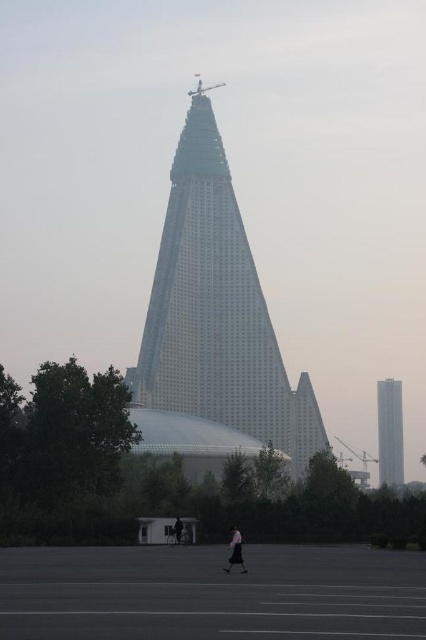
Question: Is light pink fabric skirt at lower center bigger than dark gray fabric jacket at center?

Choices:
 (A) no
 (B) yes

Answer: (B)

Question: Which of these objects is positioned closest to the dark gray fabric jacket at center?

Choices:
 (A) white glass tower at right
 (B) silver metallic pyramid at center
 (C) light pink fabric skirt at lower center

Answer: (C)

Question: Does white glass tower at right appear on the left side of light pink fabric skirt at lower center?

Choices:
 (A) no
 (B) yes

Answer: (A)

Question: Which object is closer to the camera taking this photo?

Choices:
 (A) white glass tower at right
 (B) silver metallic pyramid at center
 (C) dark gray fabric jacket at center
 (D) light pink fabric skirt at lower center

Answer: (D)

Question: Among these points, which one is farthest from the camera?

Choices:
 (A) (229, 266)
 (B) (176, 531)
 (C) (236, 541)
 (D) (394, 454)

Answer: (D)

Question: Does light pink fabric skirt at lower center appear on the left side of dark gray fabric jacket at center?

Choices:
 (A) no
 (B) yes

Answer: (A)